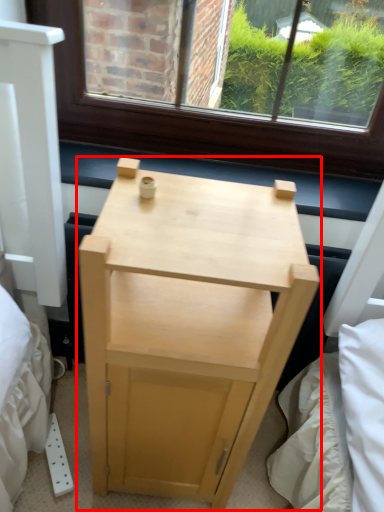
Question: From the image's perspective, considering the relative positions of nightstand (annotated by the red box) and window sill in the image provided, where is nightstand (annotated by the red box) located with respect to the staircase?

Choices:
 (A) below
 (B) above

Answer: (A)